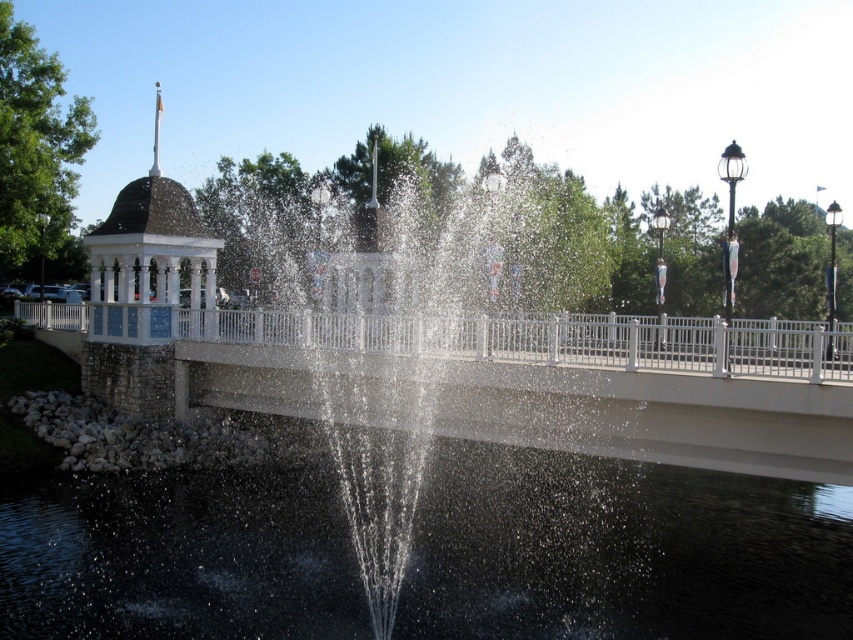
Does clear water at center have a greater width compared to white glossy gazebo at upper left?

In fact, clear water at center might be narrower than white glossy gazebo at upper left.

I want to click on clear water at center, so click(x=379, y=376).

Locate an element on the screen. clear water at center is located at coordinates (379, 376).

Does clear liquid water at center have a lesser width compared to white concrete bridge at center?

Yes, clear liquid water at center is thinner than white concrete bridge at center.

Can you confirm if clear liquid water at center is positioned below white concrete bridge at center?

Indeed, clear liquid water at center is positioned under white concrete bridge at center.

Does point (630, 483) come farther from viewer compared to point (618, 337)?

Yes.

Identify the location of clear liquid water at center. (621, 552).

Does white concrete bridge at center appear on the right side of clear water at center?

No, white concrete bridge at center is not to the right of clear water at center.

Find the location of a particular element. white concrete bridge at center is located at coordinates (595, 371).

Describe the element at coordinates (595, 371) in the screenshot. I see `white concrete bridge at center` at that location.

Find the location of `white concrete bridge at center`. white concrete bridge at center is located at coordinates (595, 371).